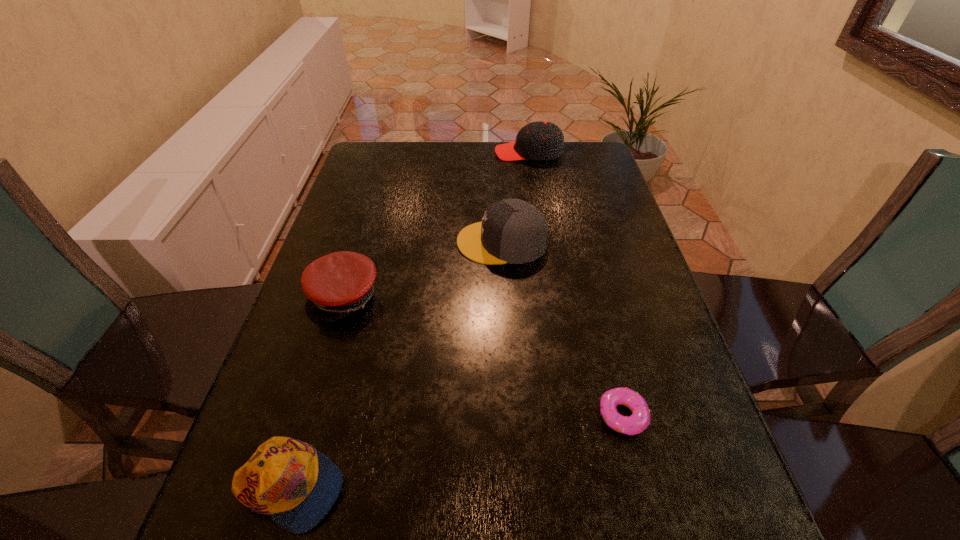
The width and height of the screenshot is (960, 540). I want to click on the farthest object, so click(539, 140).

Identify the location of the third nearest cap. (513, 231).

The height and width of the screenshot is (540, 960). Identify the location of the third farthest cap. (337, 284).

Where is `the nearest object`? Image resolution: width=960 pixels, height=540 pixels. the nearest object is located at coordinates (296, 485).

You are a GUI agent. You are given a task and a screenshot of the screen. Output one action in this format:
    pyautogui.click(x=<x>, y=<y>)
    Task: Click on the shortest object
    The height and width of the screenshot is (540, 960).
    Given the screenshot: What is the action you would take?
    pyautogui.click(x=640, y=419)

Find the location of `the fourth farthest object`. the fourth farthest object is located at coordinates (640, 419).

This screenshot has height=540, width=960. Find the location of `vacant area located on the front-facing side of the farthest object`. vacant area located on the front-facing side of the farthest object is located at coordinates (405, 153).

What are the coordinates of `free location located on the front-facing side of the farthest object` in the screenshot? It's located at (382, 153).

Where is `vacant space situated on the front-facing side of the farthest object`? The height and width of the screenshot is (540, 960). vacant space situated on the front-facing side of the farthest object is located at coordinates (431, 153).

This screenshot has height=540, width=960. I want to click on free space located on the front-facing side of the second farthest cap, so click(x=416, y=242).